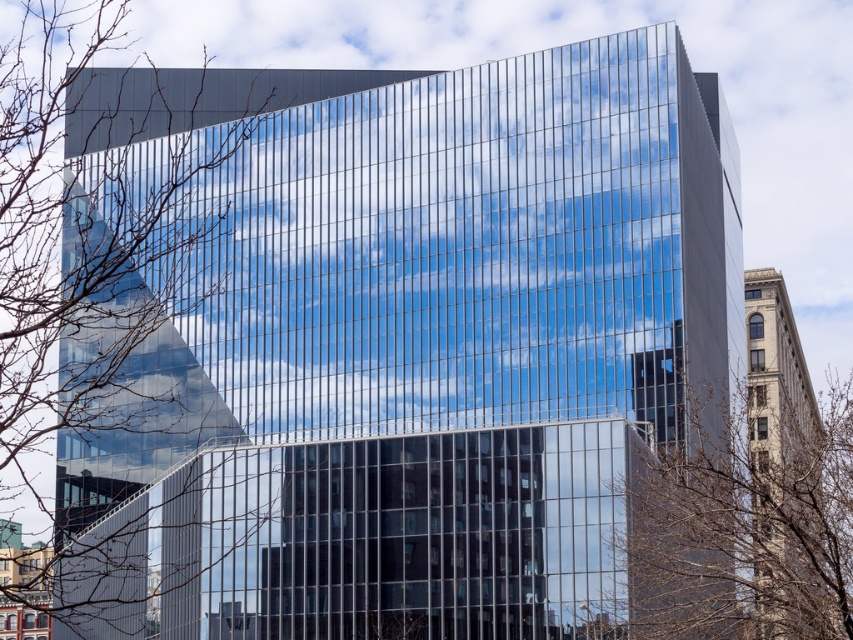
You are standing in front of the modern glass building and notice two sets of branches in the scene. Which set of branches, the bare branches at left or the brown leafless branches at center, is positioned higher in the image?

The bare branches at left is positioned higher than the brown leafless branches at center in the image.

You are standing in front of the modern glass building and looking at two points marked on the facade. The first point is at coordinate point (51, 198) and the second is at point (839, 464). Which point is closer to your eyes?

Point (51, 198) is further to the camera than point (839, 464), so the point closer to your eyes is point (839, 464).